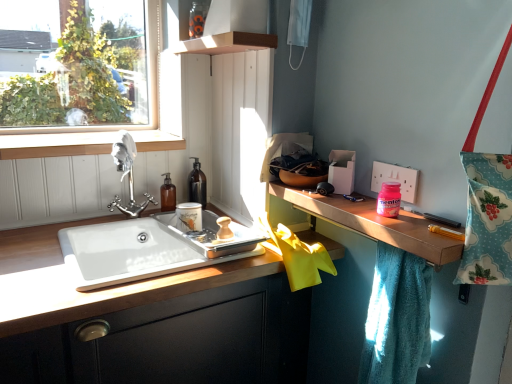
You are a GUI agent. You are given a task and a screenshot of the screen. Output one action in this format:
    pyautogui.click(x=<x>, y=<y>)
    Task: Click on the vacant space situated above wooden at right (from a real-world perspective)
    
    Given the screenshot: What is the action you would take?
    pyautogui.click(x=370, y=206)